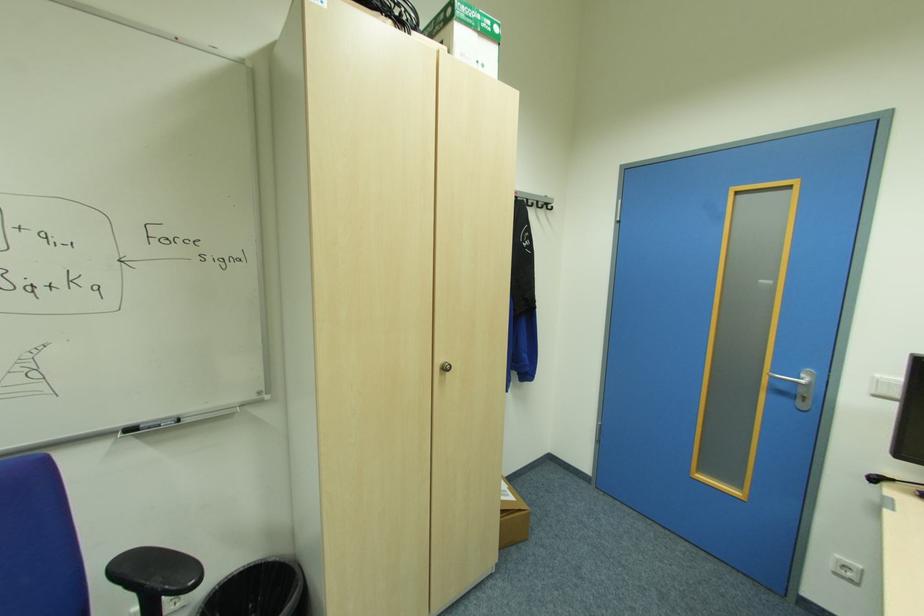
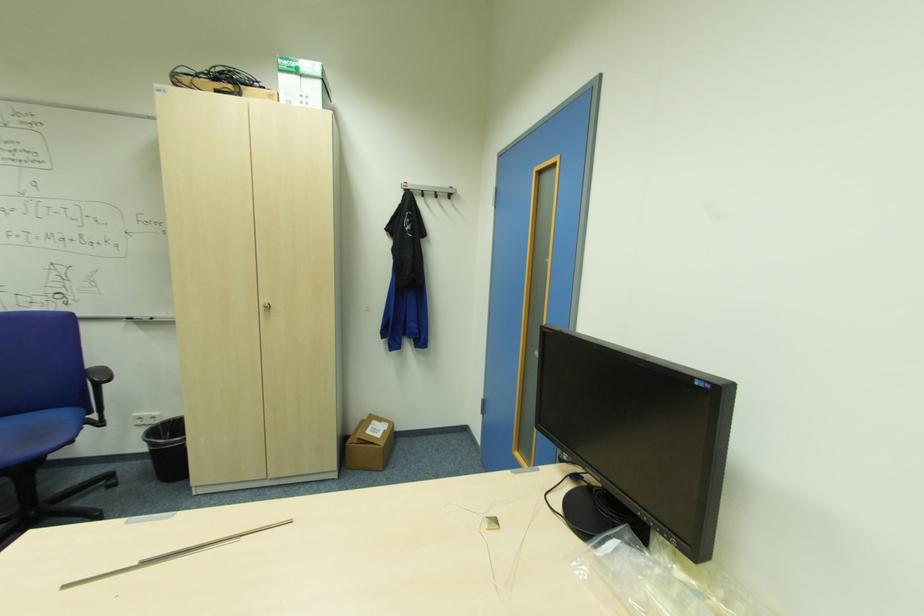
Where in the second image is the point corresponding to (x=540, y=201) from the first image?

(439, 192)